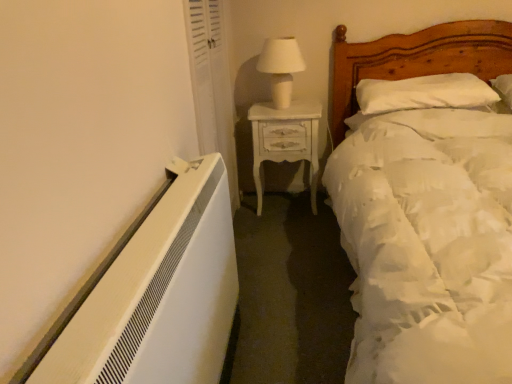
Question: Is white soft pillow at upper right looking in the opposite direction of white soft bed at right?

Choices:
 (A) yes
 (B) no

Answer: (A)

Question: From the image's perspective, is white soft pillow at upper right beneath white soft bed at right?

Choices:
 (A) no
 (B) yes

Answer: (A)

Question: Does white soft pillow at upper right contain white soft bed at right?

Choices:
 (A) no
 (B) yes

Answer: (A)

Question: Is the position of white soft pillow at upper right more distant than that of white soft bed at right?

Choices:
 (A) yes
 (B) no

Answer: (A)

Question: Is white soft pillow at upper right not inside white soft bed at right?

Choices:
 (A) yes
 (B) no

Answer: (B)

Question: Considering their positions, is white soft bed at right located in front of or behind white ceramic table lamp at upper center?

Choices:
 (A) front
 (B) behind

Answer: (A)

Question: Considering the positions of white soft bed at right and white ceramic table lamp at upper center in the image, is white soft bed at right taller or shorter than white ceramic table lamp at upper center?

Choices:
 (A) tall
 (B) short

Answer: (A)

Question: From the image's perspective, is white soft bed at right above or below white ceramic table lamp at upper center?

Choices:
 (A) below
 (B) above

Answer: (A)

Question: In terms of size, does white soft bed at right appear bigger or smaller than white ceramic table lamp at upper center?

Choices:
 (A) small
 (B) big

Answer: (B)

Question: From the image's perspective, relative to white glossy nightstand at center, is white fabric curtain at upper left above or below?

Choices:
 (A) below
 (B) above

Answer: (B)

Question: From a real-world perspective, relative to white glossy nightstand at center, is white fabric curtain at upper left vertically above or below?

Choices:
 (A) below
 (B) above

Answer: (B)

Question: Based on their sizes in the image, would you say white fabric curtain at upper left is bigger or smaller than white glossy nightstand at center?

Choices:
 (A) small
 (B) big

Answer: (A)

Question: Choose the correct answer: Is white fabric curtain at upper left inside white glossy nightstand at center or outside it?

Choices:
 (A) inside
 (B) outside

Answer: (B)

Question: In terms of height, does white soft bed at right look taller or shorter compared to white glossy nightstand at center?

Choices:
 (A) tall
 (B) short

Answer: (A)

Question: Is white soft bed at right situated inside white glossy nightstand at center or outside?

Choices:
 (A) outside
 (B) inside

Answer: (A)